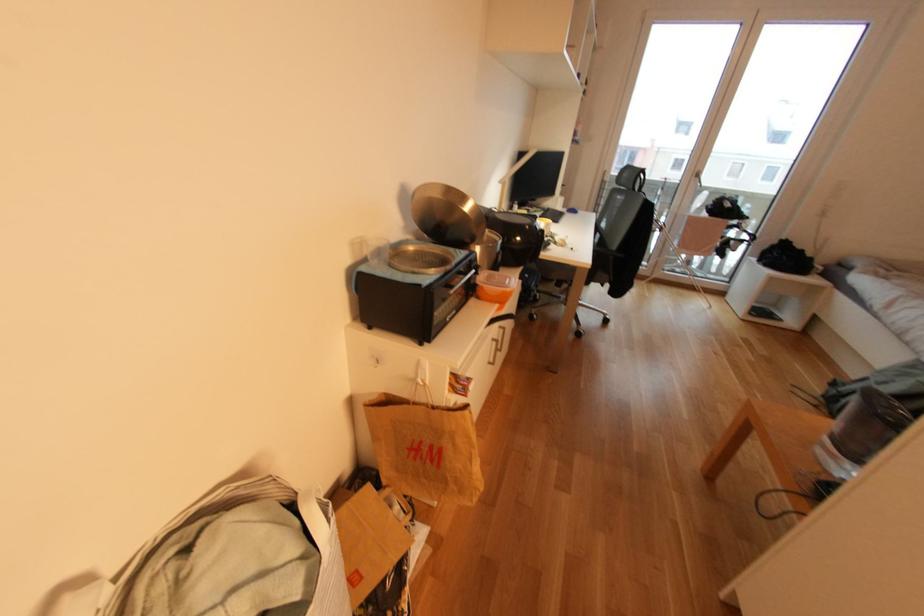
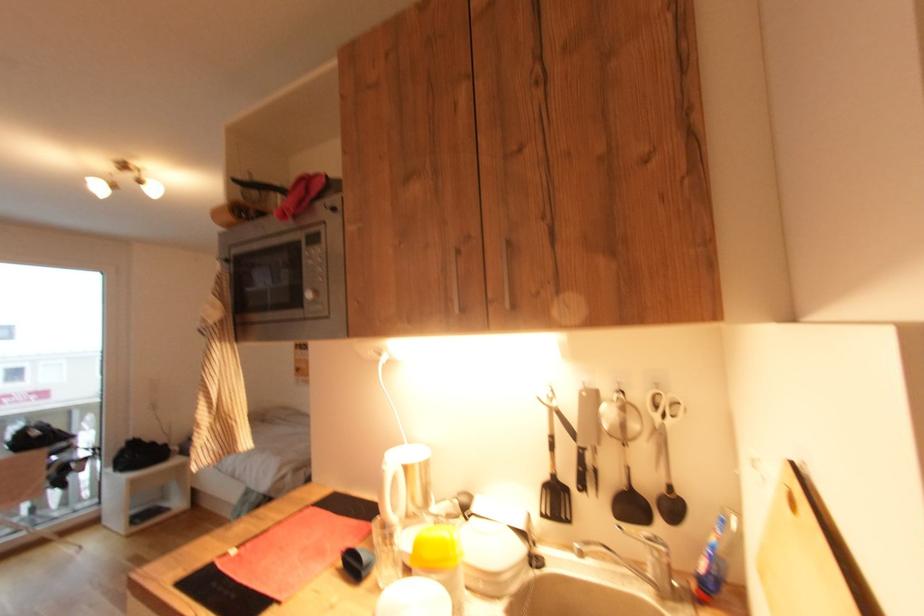
Question: The images are taken continuously from a first-person perspective. In which direction is your viewpoint rotating?

Choices:
 (A) Left
 (B) Right
 (C) Up
 (D) Down

Answer: (B)